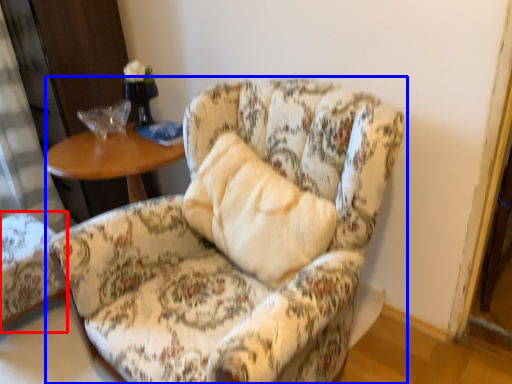
Question: Which object appears farthest to the camera in this image, chair (highlighted by a red box) or chair (highlighted by a blue box)?

Choices:
 (A) chair
 (B) chair

Answer: (A)